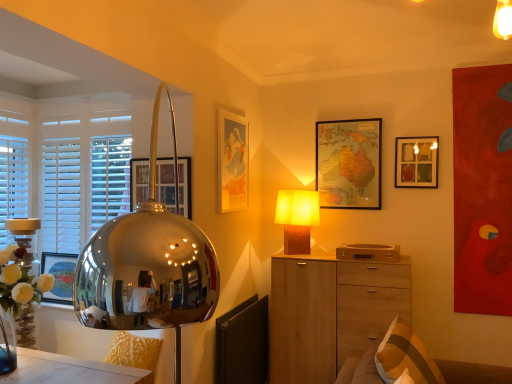
Question: Is beige fabric pillow at lower right inside metallic gold swivel chair at lower left?

Choices:
 (A) no
 (B) yes

Answer: (A)

Question: Is metallic gold swivel chair at lower left smaller than beige fabric pillow at lower right?

Choices:
 (A) no
 (B) yes

Answer: (B)

Question: Is metallic gold swivel chair at lower left further to camera compared to beige fabric pillow at lower right?

Choices:
 (A) yes
 (B) no

Answer: (A)

Question: Does metallic gold swivel chair at lower left have a lesser height compared to beige fabric pillow at lower right?

Choices:
 (A) yes
 (B) no

Answer: (A)

Question: From a real-world perspective, is metallic gold swivel chair at lower left beneath beige fabric pillow at lower right?

Choices:
 (A) no
 (B) yes

Answer: (A)

Question: Is metallic gold swivel chair at lower left thinner than beige fabric pillow at lower right?

Choices:
 (A) yes
 (B) no

Answer: (A)

Question: From the image's perspective, is matte wooden picture frame at upper right, placed as the 1th picture frame when sorted from right to left, below white wooden blinds at left?

Choices:
 (A) no
 (B) yes

Answer: (A)

Question: Is the position of matte wooden picture frame at upper right, which ranks as the 4th picture frame in left-to-right order, less distant than that of white wooden blinds at left?

Choices:
 (A) yes
 (B) no

Answer: (B)

Question: From a real-world perspective, is matte wooden picture frame at upper right, which ranks as the 4th picture frame in left-to-right order, below white wooden blinds at left?

Choices:
 (A) no
 (B) yes

Answer: (A)

Question: From the image's perspective, is matte wooden picture frame at upper right, the 2th picture frame viewed from the back, on top of white wooden blinds at left?

Choices:
 (A) yes
 (B) no

Answer: (A)

Question: Considering the relative sizes of matte wooden picture frame at upper right, placed as the 1th picture frame when sorted from right to left, and white wooden blinds at left in the image provided, is matte wooden picture frame at upper right, placed as the 1th picture frame when sorted from right to left, shorter than white wooden blinds at left?

Choices:
 (A) no
 (B) yes

Answer: (B)

Question: From a real-world perspective, does matte wooden picture frame at upper right, which ranks as the 4th picture frame in left-to-right order, stand above white wooden blinds at left?

Choices:
 (A) yes
 (B) no

Answer: (A)

Question: Does matte wooden picture frame at upper right, the 3th picture frame from the front, have a lesser height compared to wooden chest of drawers at center?

Choices:
 (A) no
 (B) yes

Answer: (B)